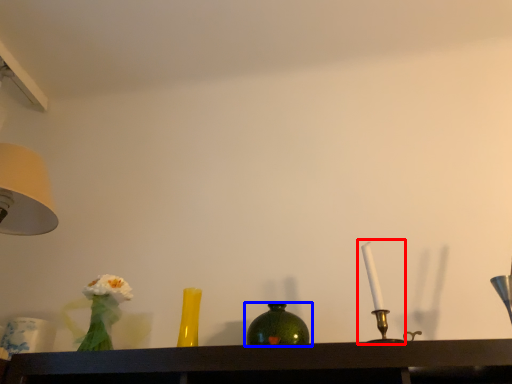
Question: Which point is further to the camera, candle holder (highlighted by a red box) or bottle (highlighted by a blue box)?

Choices:
 (A) candle holder
 (B) bottle

Answer: (B)